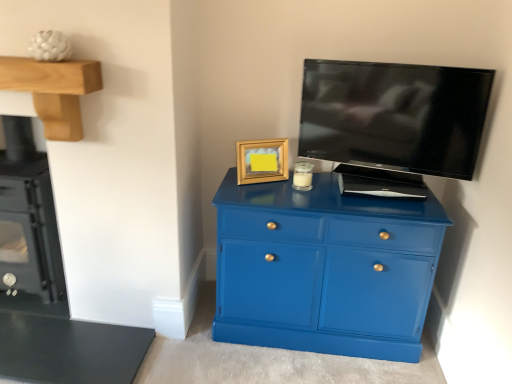
Identify the location of vacant area that is in front of translucent glass candle at center. This screenshot has height=384, width=512. (306, 198).